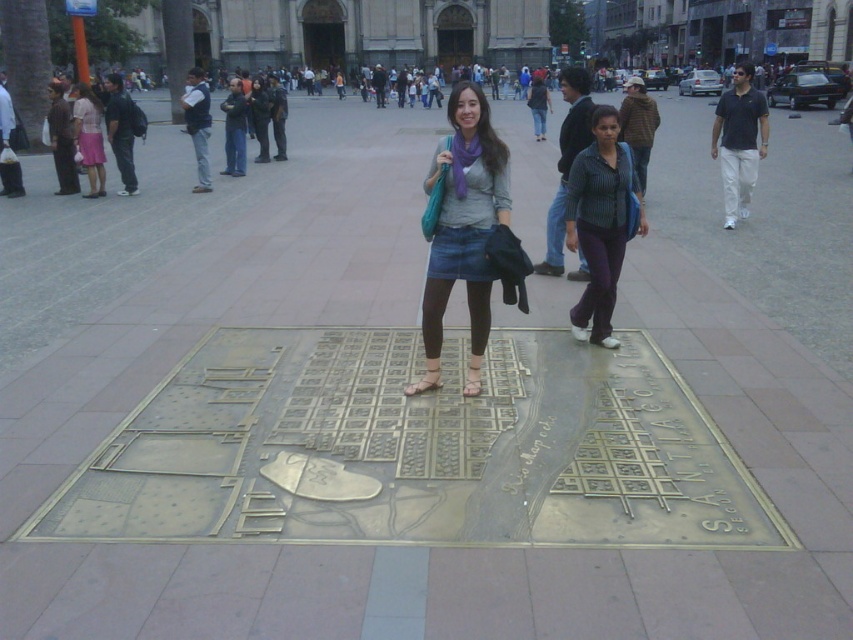
Question: Which of the following is the closest to the observer?

Choices:
 (A) (78, 132)
 (B) (601, 156)
 (C) (744, 164)
 (D) (434, 385)

Answer: (D)

Question: Is matte pink skirt at left smaller than dark blue jeans at left?

Choices:
 (A) no
 (B) yes

Answer: (B)

Question: Which object is positioned farthest from the dark blue jeans at left?

Choices:
 (A) dark gray polo shirt at right
 (B) matte pink skirt at left
 (C) striped fabric shirt at center

Answer: (A)

Question: Is striped fabric shirt at center smaller than dark blue jeans at left?

Choices:
 (A) no
 (B) yes

Answer: (B)

Question: Which of these objects is positioned closest to the striped fabric shirt at center?

Choices:
 (A) matte pink skirt at left
 (B) dark gray polo shirt at right

Answer: (B)

Question: In this image, where is denim skirt at center located relative to striped fabric shirt at center?

Choices:
 (A) left
 (B) right

Answer: (A)